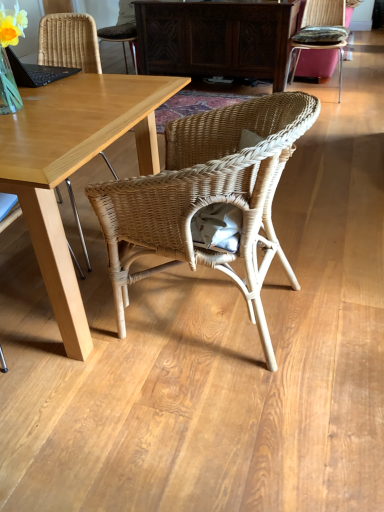
At what (x,y) coordinates should I click in order to perform the action: click on free area below natural wicker chair at center, which is the 1th chair from front to back (from a real-world perspective). Please return your answer as a coordinate pair (x, y). The image size is (384, 512). Looking at the image, I should click on (x=218, y=312).